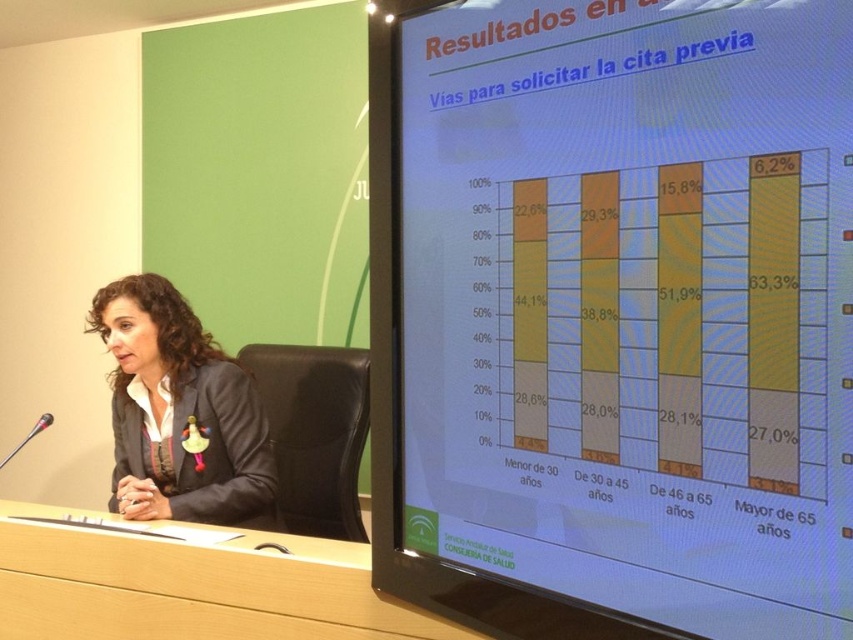
Question: Which object is closer to the camera taking this photo?

Choices:
 (A) wooden at center
 (B) matte yellow bar chart at right

Answer: (B)

Question: Can you confirm if matte yellow bar chart at right is positioned to the left of matte gray blazer at center?

Choices:
 (A) yes
 (B) no

Answer: (B)

Question: Which point is farther to the camera?

Choices:
 (A) (148, 308)
 (B) (68, 572)

Answer: (A)

Question: From the image, what is the correct spatial relationship of matte gray blazer at center in relation to wooden at center?

Choices:
 (A) above
 (B) below

Answer: (A)

Question: Is matte gray blazer at center smaller than wooden at center?

Choices:
 (A) no
 (B) yes

Answer: (A)

Question: Which object appears farthest from the camera in this image?

Choices:
 (A) matte gray blazer at center
 (B) matte yellow bar chart at right
 (C) wooden at center

Answer: (A)